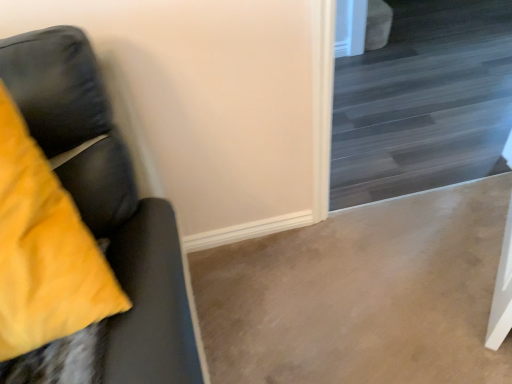
Question: From a real-world perspective, is matte black couch at left located higher than dark wood stairs at upper right?

Choices:
 (A) yes
 (B) no

Answer: (A)

Question: Is matte black couch at left thinner than dark wood stairs at upper right?

Choices:
 (A) no
 (B) yes

Answer: (A)

Question: From a real-world perspective, is matte black couch at left under dark wood stairs at upper right?

Choices:
 (A) no
 (B) yes

Answer: (A)

Question: Can you confirm if matte black couch at left is taller than dark wood stairs at upper right?

Choices:
 (A) yes
 (B) no

Answer: (B)

Question: Can you confirm if matte black couch at left is positioned to the right of dark wood stairs at upper right?

Choices:
 (A) no
 (B) yes

Answer: (A)

Question: Is dark wood stairs at upper right inside matte black couch at left?

Choices:
 (A) yes
 (B) no

Answer: (B)

Question: Is dark wood stairs at upper right located outside matte black couch at left?

Choices:
 (A) yes
 (B) no

Answer: (A)

Question: Is dark wood stairs at upper right thinner than matte black couch at left?

Choices:
 (A) no
 (B) yes

Answer: (B)

Question: Can you confirm if dark wood stairs at upper right is taller than matte black couch at left?

Choices:
 (A) no
 (B) yes

Answer: (B)

Question: From a real-world perspective, is dark wood stairs at upper right positioned over matte black couch at left based on gravity?

Choices:
 (A) yes
 (B) no

Answer: (B)

Question: From the image's perspective, does dark wood stairs at upper right appear lower than matte black couch at left?

Choices:
 (A) no
 (B) yes

Answer: (A)

Question: Is dark wood stairs at upper right in front of matte black couch at left?

Choices:
 (A) no
 (B) yes

Answer: (A)

Question: Would you say matte black couch at left is inside or outside dark wood stairs at upper right?

Choices:
 (A) inside
 (B) outside

Answer: (B)